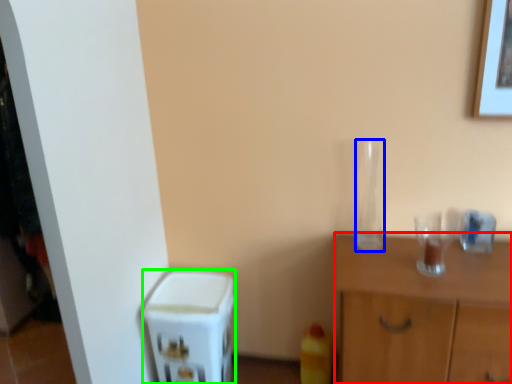
Question: Which object is the closest to the nightstand (highlighted by a red box)? Choose among these: glass vase (highlighted by a blue box) or appliance (highlighted by a green box).

Choices:
 (A) glass vase
 (B) appliance

Answer: (A)